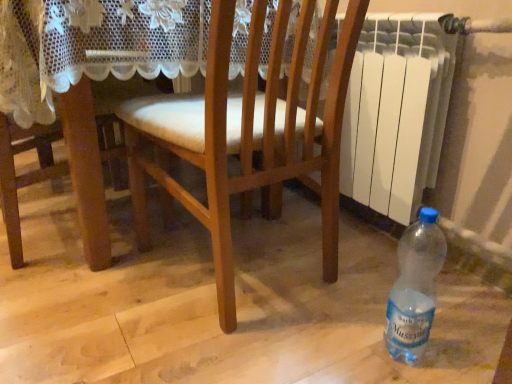
This screenshot has height=384, width=512. Identify the location of vacant space that's between wooden chair at center and translucent plastic bottle at lower right. (324, 331).